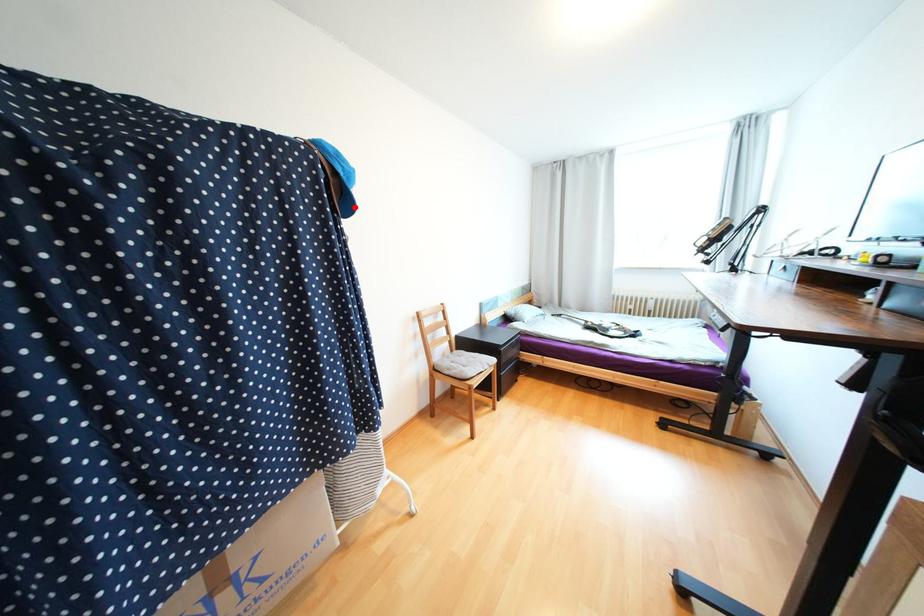
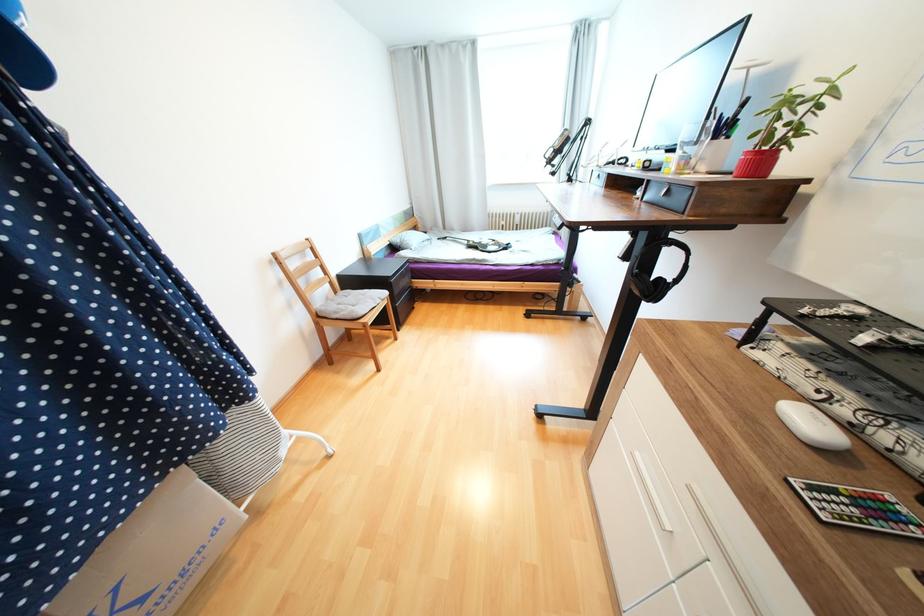
Locate, in the second image, the point that corresponds to the highlighted location in the first image.

(33, 62)